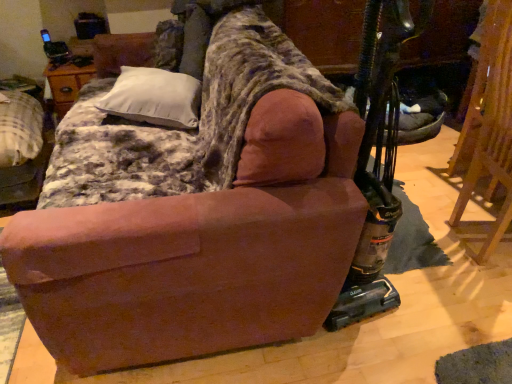
Question: From a real-world perspective, relative to brown suede couch at center, is velvet-like brown armchair at center-left vertically above or below?

Choices:
 (A) below
 (B) above

Answer: (A)

Question: In the image, is velvet-like brown armchair at center-left on the left side or the right side of brown suede couch at center?

Choices:
 (A) right
 (B) left

Answer: (B)

Question: Considering the real-world distances, which object is farthest from the wooden folding chair at right?

Choices:
 (A) velvet-like brown armchair at center-left
 (B) white soft pillow at upper left
 (C) brown suede couch at center

Answer: (A)

Question: Estimate the real-world distances between objects in this image. Which object is closer to the velvet-like brown armchair at center-left?

Choices:
 (A) white soft pillow at upper left
 (B) brown suede couch at center
 (C) wooden folding chair at right

Answer: (A)